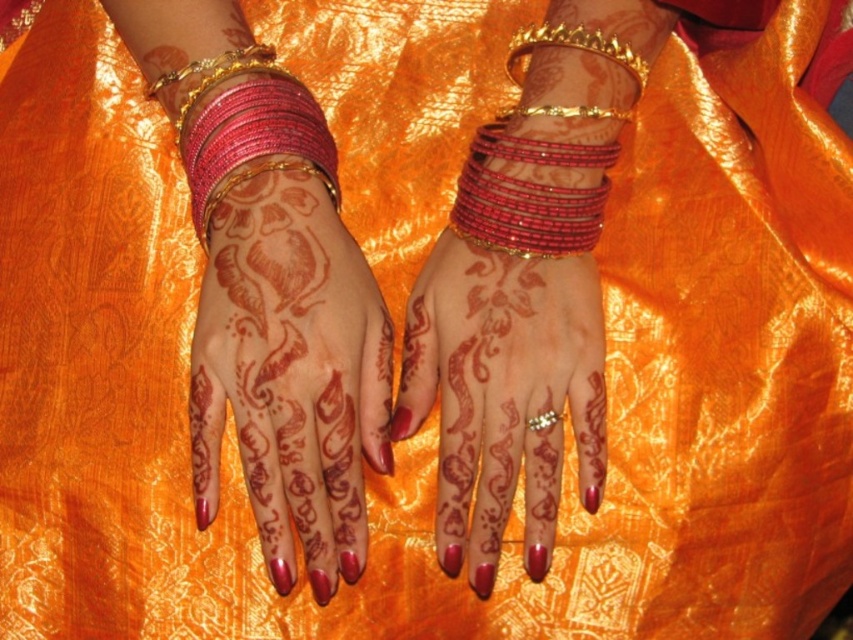
Question: Does brown henna design at center lie behind gold metallic bracelet at upper center?

Choices:
 (A) no
 (B) yes

Answer: (A)

Question: Can you confirm if brown henna design at center is positioned above shiny red beaded bangles at center?

Choices:
 (A) no
 (B) yes

Answer: (A)

Question: Which point appears farthest from the camera in this image?

Choices:
 (A) (247, 339)
 (B) (570, 388)
 (C) (602, 113)

Answer: (C)

Question: Which point is closer to the camera?

Choices:
 (A) (259, 113)
 (B) (497, 388)

Answer: (B)

Question: Does brown henna design at center have a greater width compared to gold metallic bracelet at upper center?

Choices:
 (A) no
 (B) yes

Answer: (B)

Question: Based on their relative distances, which object is nearer to the gold metallic bracelet at upper center?

Choices:
 (A) shiny pink beaded bangles at left
 (B) brown henna design at center

Answer: (A)